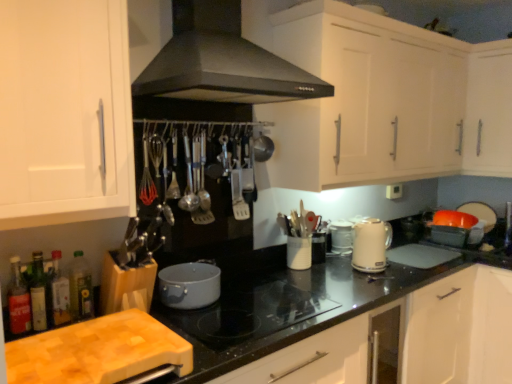
You are a GUI agent. You are given a task and a screenshot of the screen. Output one action in this format:
    pyautogui.click(x=<x>, y=<y>)
    Task: Click on the vacant area located to the right-hand side of white textured container at center, which is the 4th appliance from right to left
    
    Given the screenshot: What is the action you would take?
    pyautogui.click(x=337, y=271)